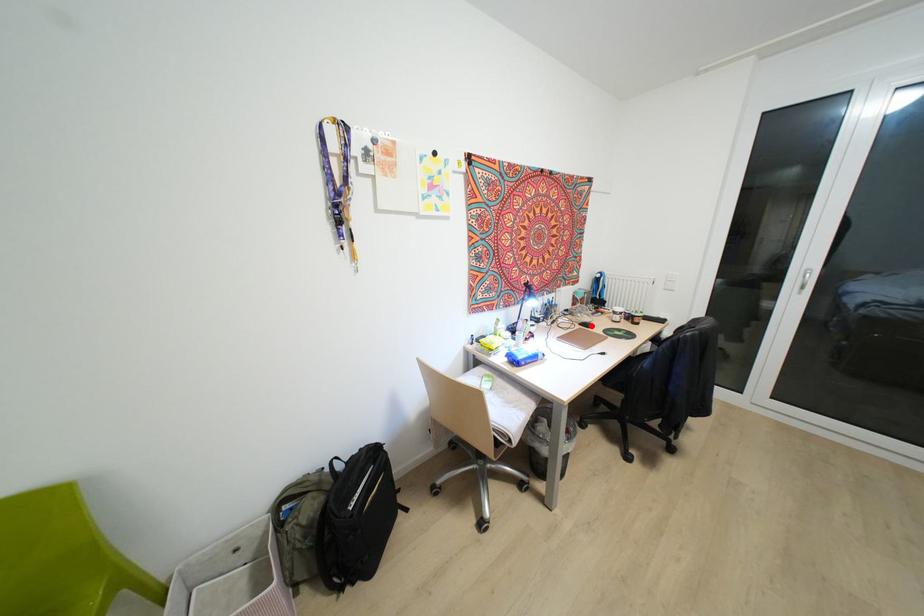
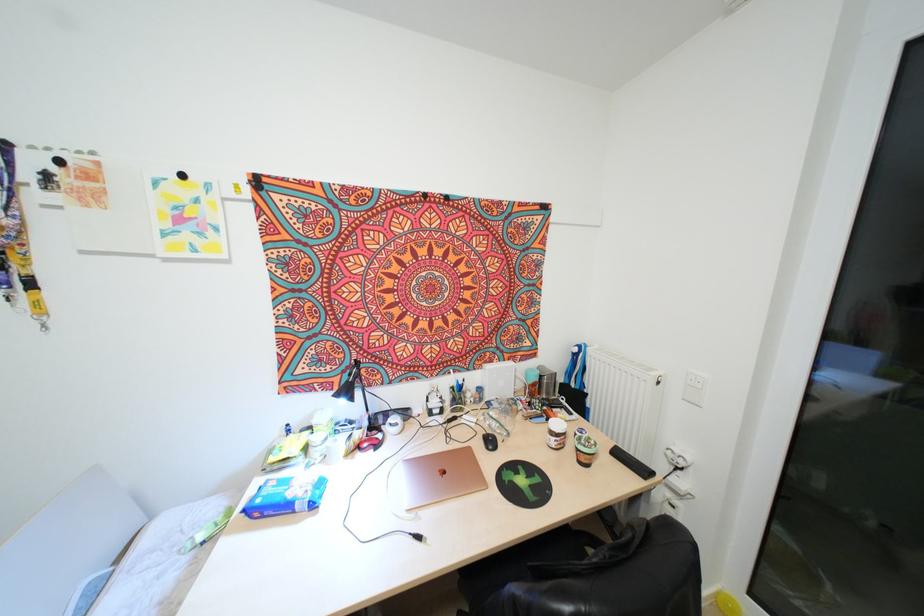
Question: I am providing you with two images of the same scene from different viewpoints. In image1, a red point is highlighted. Considering the same 3D point in image2, which of the following is correct?

Choices:
 (A) It is closer
 (B) It is farther

Answer: (B)